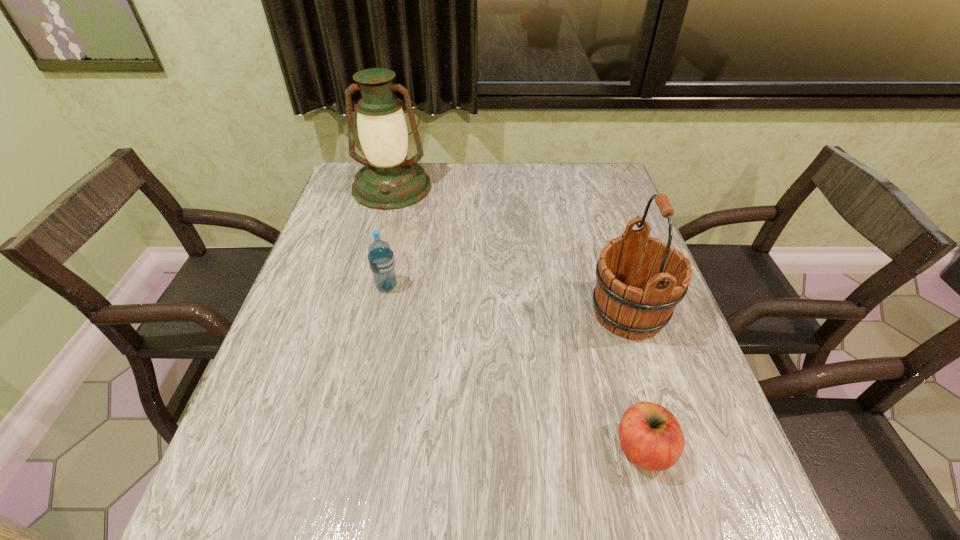
Where is `blank region between the farthest object and the nearest object`? This screenshot has width=960, height=540. blank region between the farthest object and the nearest object is located at coordinates (517, 318).

The width and height of the screenshot is (960, 540). I want to click on free space between the farthest object and the third tallest object, so click(x=390, y=237).

The height and width of the screenshot is (540, 960). What are the coordinates of `vacant point located between the nearest object and the farthest object` in the screenshot? It's located at (517, 318).

You are a GUI agent. You are given a task and a screenshot of the screen. Output one action in this format:
    pyautogui.click(x=<x>, y=<y>)
    Task: Click on the vacant space in between the wine bucket and the apple
    The height and width of the screenshot is (540, 960).
    Given the screenshot: What is the action you would take?
    pyautogui.click(x=636, y=381)

I want to click on free spot between the third tallest object and the wine bucket, so click(x=508, y=300).

Identify the location of free spot between the wine bucket and the farthest object. (510, 250).

You are a GUI agent. You are given a task and a screenshot of the screen. Output one action in this format:
    pyautogui.click(x=<x>, y=<y>)
    Task: Click on the free point between the nearest object and the wine bucket
    Image resolution: width=960 pixels, height=540 pixels.
    Given the screenshot: What is the action you would take?
    pyautogui.click(x=636, y=381)

Identify the location of object identified as the third closest to the nearest object. Image resolution: width=960 pixels, height=540 pixels. (388, 181).

Identify which object is located as the nearest to the farthest object. Please provide its 2D coordinates. Your answer should be formatted as a tuple, i.e. [(x, y)], where the tuple contains the x and y coordinates of a point satisfying the conditions above.

[(380, 256)]

Locate an element on the screen. This screenshot has width=960, height=540. vacant space that satisfies the following two spatial constraints: 1. with the light compartment facing forward on the nearest object; 2. on the left side of the farthest object is located at coordinates (324, 449).